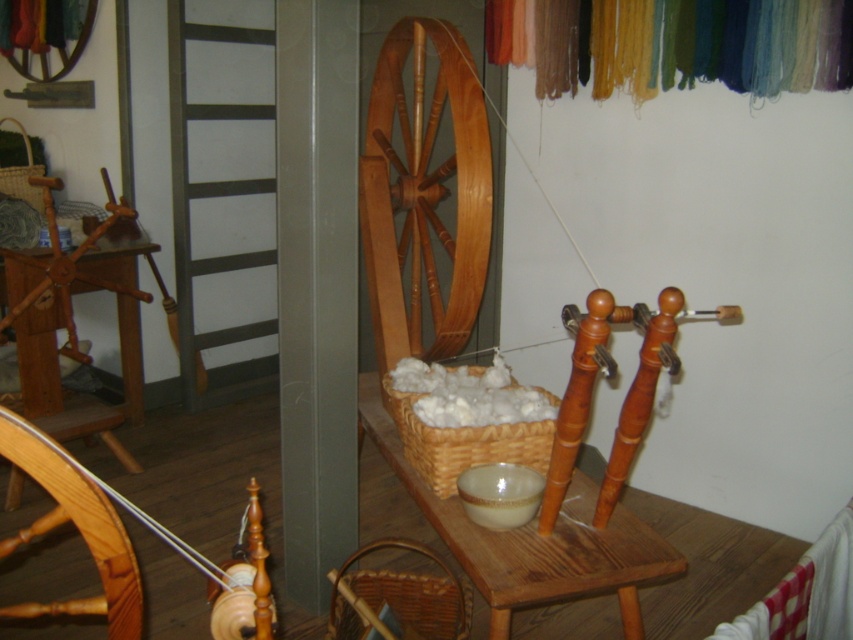
You are standing in the workshop and want to touch the wooden spinning wheel at center. Which object is closest to the point at coordinates point at (x=426, y=189)?

The point at coordinates point at (x=426, y=189) is on the wooden spinning wheel at center, so the closest object to that point is the wooden spinning wheel at center itself.

You are a craftsperson working at the table and need to access the white fluffy wool at center. Is the woven wicker basket at center blocking your access to it?

The woven wicker basket at center is in front of the white fluffy wool at center, so it is blocking access to it.